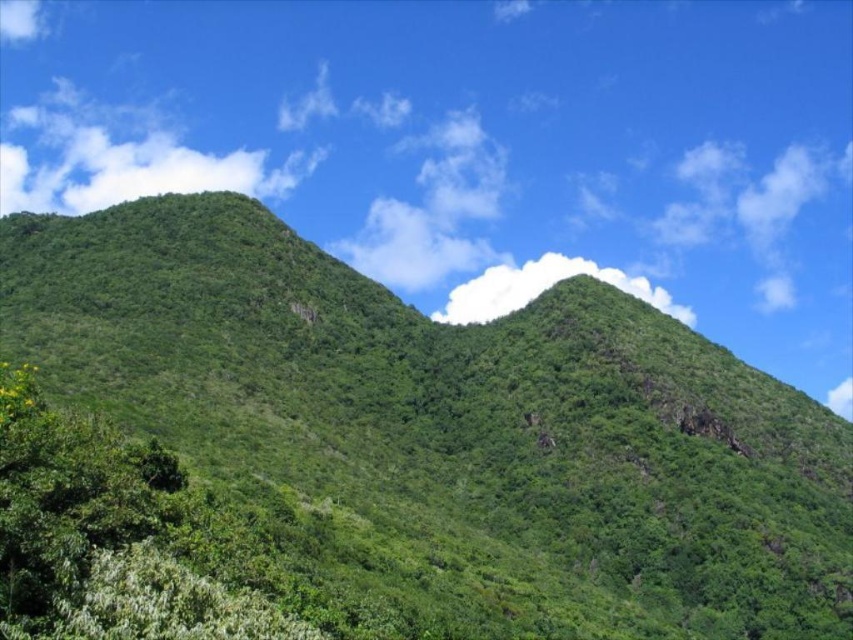
You are a hiker standing at point (111, 538). You see a green leafy tree at left. Which direction should you walk to reach the tree?

The green leafy tree at left is located to your left side from your current position at point (111, 538). To reach it, you should walk towards your left direction.

Based on the scene description, which object is positioned higher in the image, the green leafy hillside at center or the white fluffy cloud at upper center?

The white fluffy cloud at upper center is positioned higher in the image than the green leafy hillside at center.

You are a hiker standing at the center of the image. You want to take a photo of the green leafy tree at left. In which direction should you point your camera?

You should point your camera to the left to capture the green leafy tree at left, as it is located at point (111, 538) which is on the left side of the image.